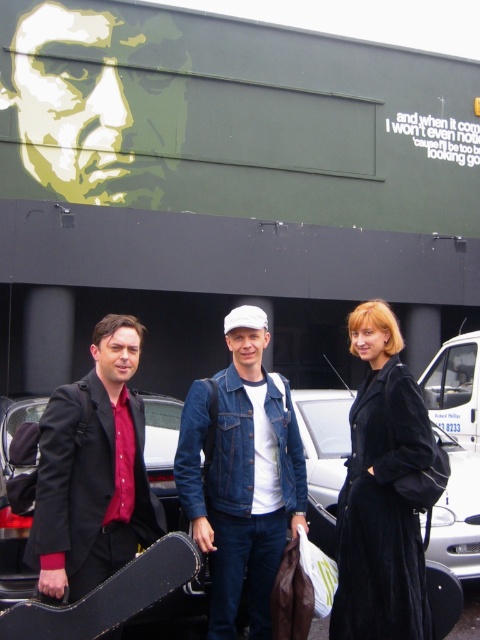
Question: Which point is closer to the camera?

Choices:
 (A) velvet black coat at center
 (B) denim jacket at center
 (C) matte black jacket at left

Answer: (C)

Question: In this image, where is denim jacket at center located relative to velvet black coat at center?

Choices:
 (A) right
 (B) left

Answer: (B)

Question: Which of the following is the farthest from the observer?

Choices:
 (A) denim jacket at center
 (B) matte black jacket at left
 (C) velvet black coat at center

Answer: (A)

Question: Which point is closer to the camera?

Choices:
 (A) click(x=94, y=385)
 (B) click(x=262, y=508)

Answer: (A)

Question: From the image, what is the correct spatial relationship of denim jacket at center in relation to velvet black coat at center?

Choices:
 (A) above
 (B) below

Answer: (B)

Question: Is denim jacket at center behind matte black jacket at left?

Choices:
 (A) yes
 (B) no

Answer: (A)